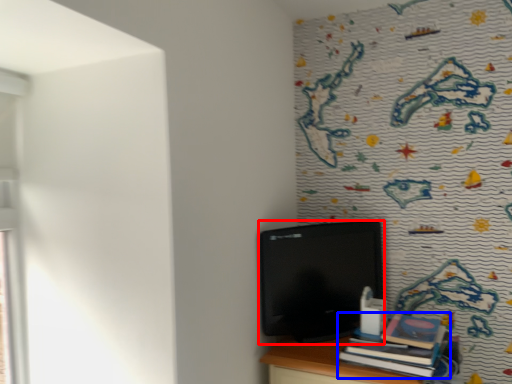
Question: Which object is closer to the camera taking this photo, computer (highlighted by a red box) or book (highlighted by a blue box)?

Choices:
 (A) computer
 (B) book

Answer: (B)